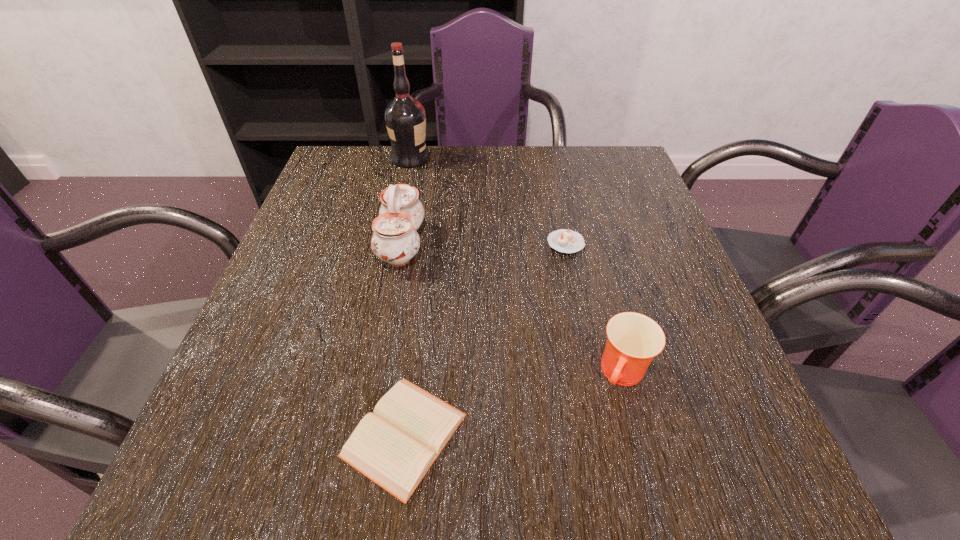
This screenshot has width=960, height=540. Identify the location of free space located on the right of the diary. (680, 435).

In order to click on object that is positioned at the far edge in this screenshot , I will do `click(405, 117)`.

The image size is (960, 540). I want to click on object present at the near edge, so click(x=395, y=446).

Find the location of a particular element. object that is positioned at the right edge is located at coordinates (633, 340).

Identify the location of vacant space at the far edge of the desktop. Image resolution: width=960 pixels, height=540 pixels. (569, 184).

Image resolution: width=960 pixels, height=540 pixels. I want to click on free space at the near edge, so click(553, 454).

Find the location of a particular element. Image resolution: width=960 pixels, height=540 pixels. free space at the left edge is located at coordinates (342, 251).

Identify the location of vacant space at the right edge of the desktop. This screenshot has width=960, height=540. [x=703, y=313].

Find the location of a particular element. The height and width of the screenshot is (540, 960). vacant space at the far left corner is located at coordinates (354, 148).

At what (x,y) coordinates should I click in order to perform the action: click on vacant position at the far right corner of the desktop. Please return your answer as a coordinate pair (x, y). This screenshot has height=540, width=960. Looking at the image, I should click on tap(611, 148).